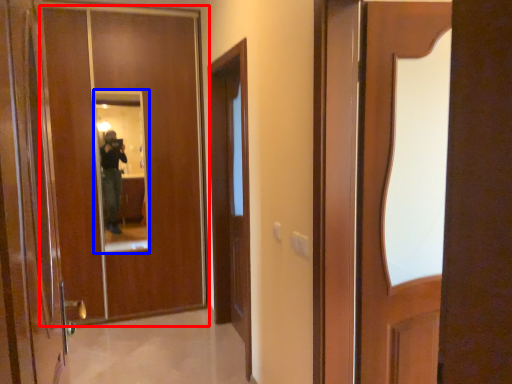
Question: Among these objects, which one is nearest to the camera, door (highlighted by a red box) or mirror (highlighted by a blue box)?

Choices:
 (A) door
 (B) mirror

Answer: (A)